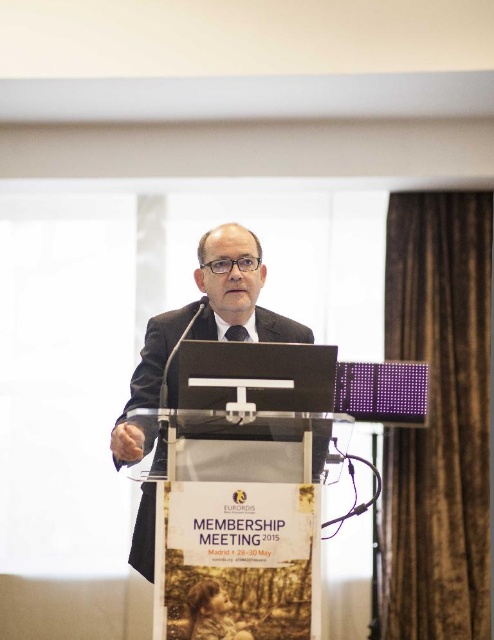
Question: Does matte black suit at center lie in front of black textured tie at center?

Choices:
 (A) no
 (B) yes

Answer: (B)

Question: Among these points, which one is farthest from the camera?

Choices:
 (A) (232, 326)
 (B) (279, 323)

Answer: (B)

Question: Which point is closer to the camera taking this photo?

Choices:
 (A) (164, 442)
 (B) (237, 328)

Answer: (A)

Question: From the image, what is the correct spatial relationship of matte black suit at center in relation to black textured tie at center?

Choices:
 (A) right
 (B) left

Answer: (B)

Question: Can you confirm if matte black suit at center is positioned below black textured tie at center?

Choices:
 (A) yes
 (B) no

Answer: (A)